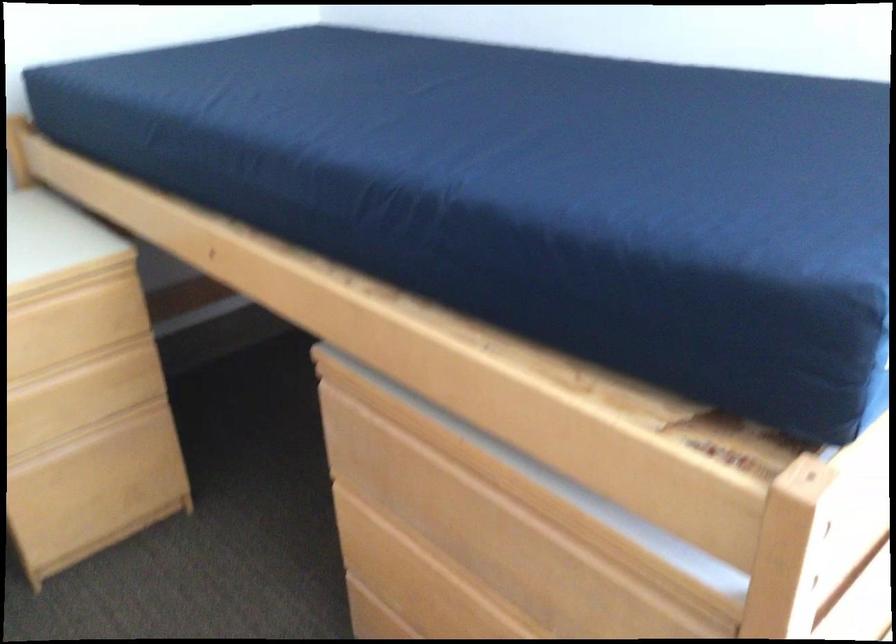
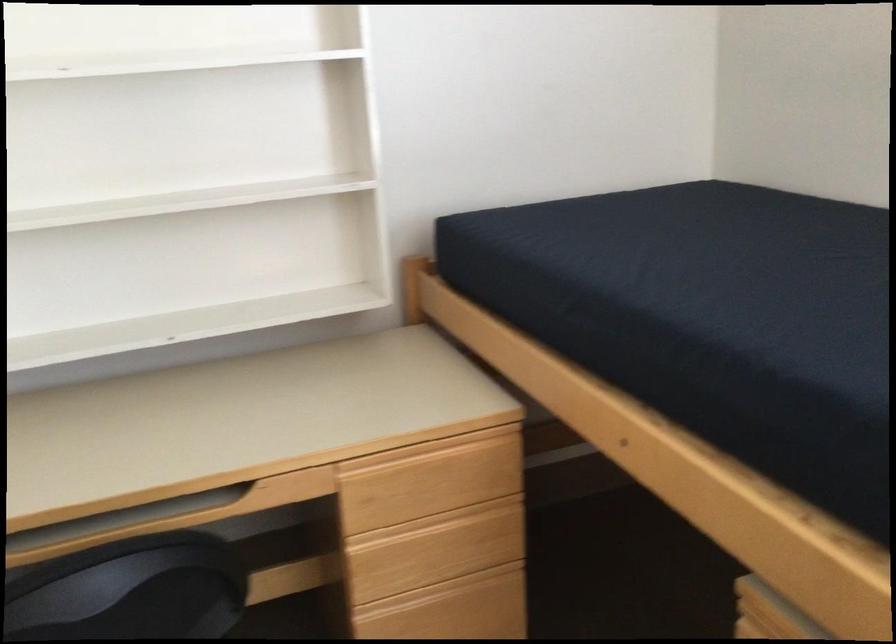
Find the pixel in the second image that matches [89,440] in the first image.

(442, 592)